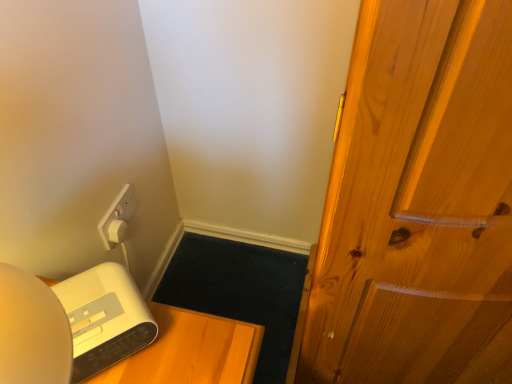
The width and height of the screenshot is (512, 384). Identify the location of free space above white plastic alarm clock at lower left (from a real-world perspective). pyautogui.click(x=96, y=303).